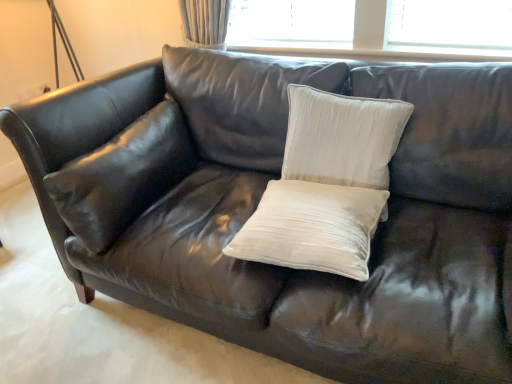
Question: Which direction should I rotate to look at satin white pillow at center, which ranks as the second pillow in right-to-left order, — up or down?

Choices:
 (A) down
 (B) up

Answer: (A)

Question: Is satin white pillow at center, which is counted as the third pillow, starting from the right, positioned before white velvet pillow at center, which is counted as the third pillow, starting from the left?

Choices:
 (A) no
 (B) yes

Answer: (A)

Question: From a real-world perspective, is satin white pillow at center, which is counted as the third pillow, starting from the right, below white velvet pillow at center, arranged as the 1th pillow when viewed from the right?

Choices:
 (A) yes
 (B) no

Answer: (A)

Question: Is satin white pillow at center, which is counted as the third pillow, starting from the right, positioned beyond the bounds of white velvet pillow at center, which is counted as the third pillow, starting from the left?

Choices:
 (A) no
 (B) yes

Answer: (B)

Question: Is satin white pillow at center, which is counted as the third pillow, starting from the right, positioned behind white velvet pillow at center, which is counted as the third pillow, starting from the left?

Choices:
 (A) no
 (B) yes

Answer: (B)

Question: Is satin white pillow at center, which is the 1th pillow from left to right, next to white velvet pillow at center, which is counted as the third pillow, starting from the left, and touching it?

Choices:
 (A) no
 (B) yes

Answer: (A)

Question: Is satin white pillow at center, which is the 1th pillow from left to right, facing away from white velvet pillow at center, which is counted as the third pillow, starting from the left?

Choices:
 (A) no
 (B) yes

Answer: (A)

Question: Considering the relative positions of satin white pillow at center, which is counted as the third pillow, starting from the right, and satin white pillow at center, acting as the 2th pillow starting from the left, in the image provided, is satin white pillow at center, which is counted as the third pillow, starting from the right, to the right of satin white pillow at center, acting as the 2th pillow starting from the left, from the viewer's perspective?

Choices:
 (A) yes
 (B) no

Answer: (B)

Question: Is satin white pillow at center, which is the 1th pillow from left to right, aimed at satin white pillow at center, acting as the 2th pillow starting from the left?

Choices:
 (A) yes
 (B) no

Answer: (A)

Question: Is satin white pillow at center, which is the 1th pillow from left to right, next to satin white pillow at center, acting as the 2th pillow starting from the left, and touching it?

Choices:
 (A) no
 (B) yes

Answer: (A)

Question: Can you confirm if satin white pillow at center, which is counted as the third pillow, starting from the right, is taller than satin white pillow at center, acting as the 2th pillow starting from the left?

Choices:
 (A) no
 (B) yes

Answer: (B)

Question: Is satin white pillow at center, which is the 1th pillow from left to right, in front of satin white pillow at center, which ranks as the second pillow in right-to-left order?

Choices:
 (A) no
 (B) yes

Answer: (A)

Question: From a real-world perspective, is white velvet pillow at center, which is counted as the third pillow, starting from the left, located beneath satin white pillow at center, which is counted as the third pillow, starting from the right?

Choices:
 (A) yes
 (B) no

Answer: (B)